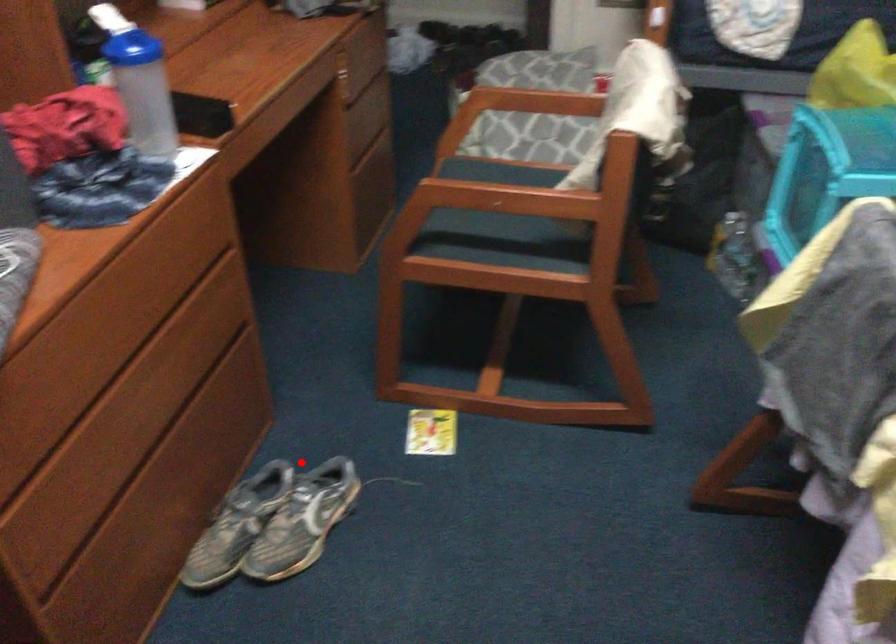
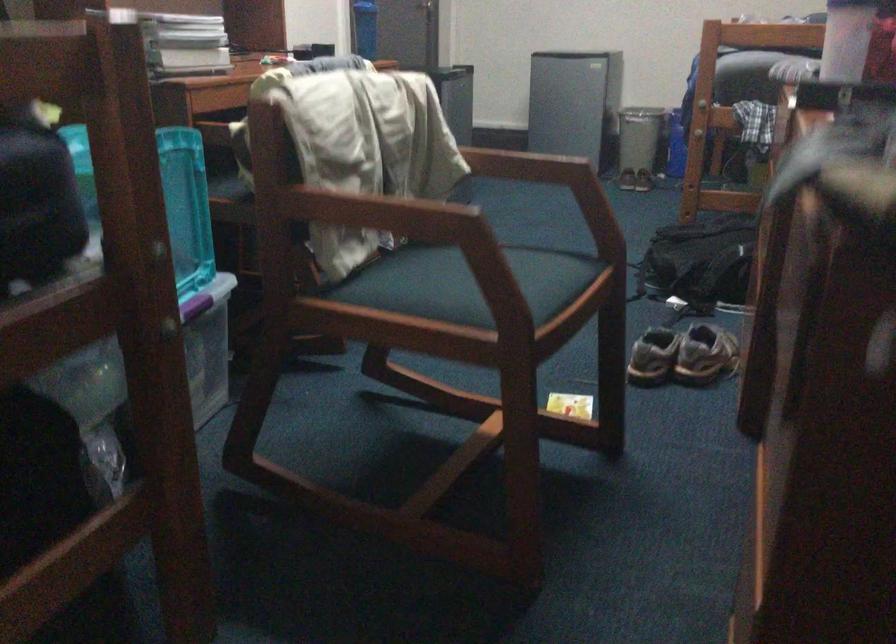
Find the pixel in the second image that matches the highlighted location in the first image.

(682, 355)